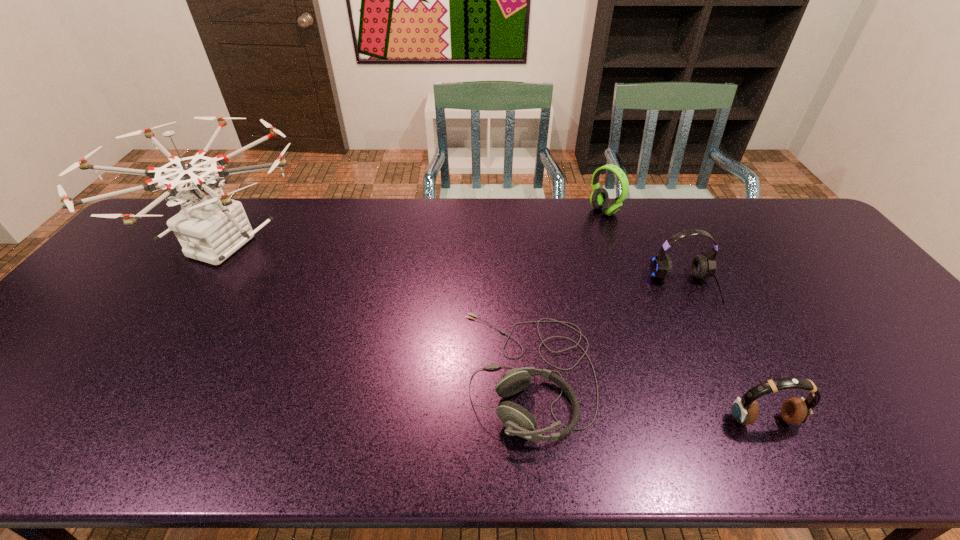
Point out which headset is positioned as the fourth nearest to the leftmost object. Please provide its 2D coordinates. Your answer should be formatted as a tuple, i.e. [(x, y)], where the tuple contains the x and y coordinates of a point satisfying the conditions above.

[(794, 411)]